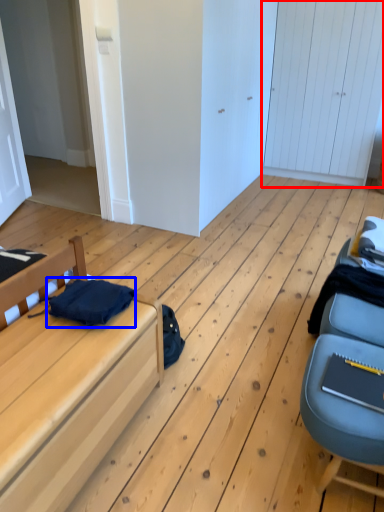
Question: Among these objects, which one is farthest to the camera, door (highlighted by a red box) or clothing (highlighted by a blue box)?

Choices:
 (A) door
 (B) clothing

Answer: (A)